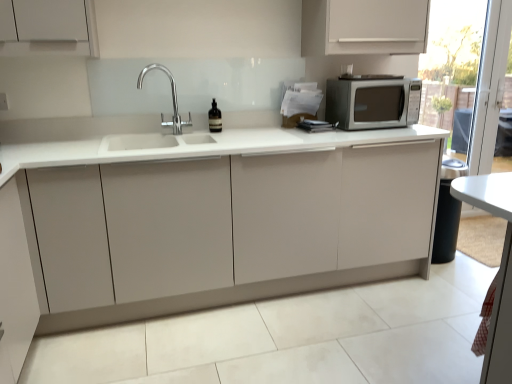
Question: Is the depth of matte white cabinet at center less than that of transparent glass screen door at right?

Choices:
 (A) yes
 (B) no

Answer: (A)

Question: From a real-world perspective, is matte white cabinet at center below transparent glass screen door at right?

Choices:
 (A) no
 (B) yes

Answer: (B)

Question: Is matte white cabinet at center far from transparent glass screen door at right?

Choices:
 (A) no
 (B) yes

Answer: (B)

Question: Considering the relative sizes of matte white cabinet at center and transparent glass screen door at right in the image provided, is matte white cabinet at center wider than transparent glass screen door at right?

Choices:
 (A) yes
 (B) no

Answer: (A)

Question: Is matte white cabinet at center oriented away from transparent glass screen door at right?

Choices:
 (A) yes
 (B) no

Answer: (B)

Question: Considering the positions of point (429, 124) and point (334, 79), is point (429, 124) closer or farther from the camera than point (334, 79)?

Choices:
 (A) closer
 (B) farther

Answer: (B)

Question: In the image, is transparent glass screen door at right on the left side or the right side of satin silver microwave at upper right?

Choices:
 (A) right
 (B) left

Answer: (A)

Question: Would you say transparent glass screen door at right is inside or outside satin silver microwave at upper right?

Choices:
 (A) outside
 (B) inside

Answer: (A)

Question: Based on their sizes in the image, would you say transparent glass screen door at right is bigger or smaller than satin silver microwave at upper right?

Choices:
 (A) big
 (B) small

Answer: (A)

Question: Is satin silver microwave at upper right to the left or to the right of matte white cabinet at center in the image?

Choices:
 (A) right
 (B) left

Answer: (A)

Question: Considering their positions, is satin silver microwave at upper right located in front of or behind matte white cabinet at center?

Choices:
 (A) front
 (B) behind

Answer: (B)

Question: In terms of height, does satin silver microwave at upper right look taller or shorter compared to matte white cabinet at center?

Choices:
 (A) short
 (B) tall

Answer: (A)

Question: Is satin silver microwave at upper right inside or outside of matte white cabinet at center?

Choices:
 (A) inside
 (B) outside

Answer: (A)

Question: From a real-world perspective, is white glossy table at lower right positioned above or below chrome/metallic faucet at center?

Choices:
 (A) below
 (B) above

Answer: (A)

Question: Considering the positions of white glossy table at lower right and chrome/metallic faucet at center in the image, is white glossy table at lower right bigger or smaller than chrome/metallic faucet at center?

Choices:
 (A) small
 (B) big

Answer: (A)